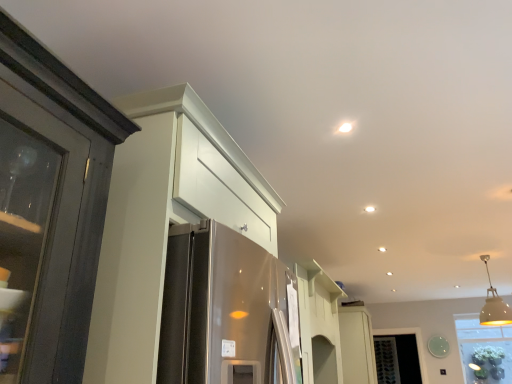
Question: Can you confirm if white glossy cabinet at center, which ranks as the second cabinetry in top-to-bottom order, is taller than white matte pendant light at upper right?

Choices:
 (A) yes
 (B) no

Answer: (A)

Question: Is white glossy cabinet at center, the 1th cabinetry when ordered from back to front, beside white matte pendant light at upper right?

Choices:
 (A) yes
 (B) no

Answer: (B)

Question: Would you consider white glossy cabinet at center, which is the 2th cabinetry in front-to-back order, to be distant from white matte pendant light at upper right?

Choices:
 (A) yes
 (B) no

Answer: (A)

Question: Is white glossy cabinet at center, the first cabinetry positioned from the bottom, smaller than white matte pendant light at upper right?

Choices:
 (A) yes
 (B) no

Answer: (B)

Question: From a real-world perspective, is white glossy cabinet at center, which ranks as the second cabinetry in top-to-bottom order, under white matte pendant light at upper right?

Choices:
 (A) no
 (B) yes

Answer: (B)

Question: From the image's perspective, is white glossy cabinet at center, the 1th cabinetry positioned from the right, over white matte pendant light at upper right?

Choices:
 (A) yes
 (B) no

Answer: (B)

Question: From a real-world perspective, is white glossy cabinet at upper left, the 1th cabinetry positioned from the left, below white glossy cabinet at center, the first cabinetry positioned from the bottom?

Choices:
 (A) no
 (B) yes

Answer: (A)

Question: Could you tell me if white glossy cabinet at upper left, the second cabinetry when ordered from bottom to top, is facing white glossy cabinet at center, which is the 2th cabinetry in front-to-back order?

Choices:
 (A) yes
 (B) no

Answer: (B)

Question: Considering the relative sizes of white glossy cabinet at upper left, acting as the first cabinetry starting from the front, and white glossy cabinet at center, which is the 2th cabinetry in front-to-back order, in the image provided, is white glossy cabinet at upper left, acting as the first cabinetry starting from the front, taller than white glossy cabinet at center, which is the 2th cabinetry in front-to-back order,?

Choices:
 (A) no
 (B) yes

Answer: (A)

Question: Does white glossy cabinet at upper left, the 1th cabinetry positioned from the left, have a larger size compared to white glossy cabinet at center, the 1th cabinetry when ordered from back to front?

Choices:
 (A) yes
 (B) no

Answer: (A)

Question: Can you confirm if white glossy cabinet at upper left, which ranks as the first cabinetry in top-to-bottom order, is thinner than white glossy cabinet at center, which ranks as the second cabinetry in top-to-bottom order?

Choices:
 (A) yes
 (B) no

Answer: (B)

Question: From a real-world perspective, is white glossy cabinet at upper left, which ranks as the first cabinetry in top-to-bottom order, over white glossy cabinet at center, the first cabinetry positioned from the bottom?

Choices:
 (A) no
 (B) yes

Answer: (B)

Question: Is white glossy cabinet at center, the 1th cabinetry positioned from the right, to the right of white glossy cabinet at upper left, acting as the first cabinetry starting from the front, from the viewer's perspective?

Choices:
 (A) no
 (B) yes

Answer: (B)